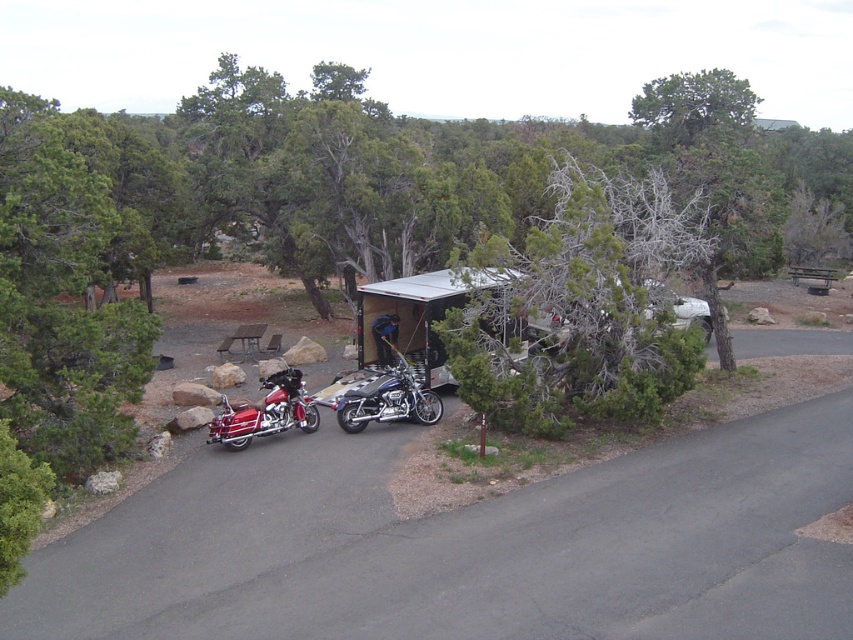
You are planning to set up a picnic table between the shiny blue chrome motorcycle at center and the brown wooden picnic table at center. Which side of the picnic table should you place the motorcycle on?

The shiny blue chrome motorcycle at center is already to the right of the brown wooden picnic table at center, so you should place the motorcycle on the right side of the picnic table.

You are planning to transport both the shiny blue chrome motorcycle at center and the brown wooden picnic table at center in a truck. Given that the truck bed is 2 meters wide, can both items fit side by side without overlapping?

The shiny blue chrome motorcycle at center is wider than the brown wooden picnic table at center. Since the truck bed is only 2 meters wide, and the motorcycle alone is already wider than the picnic table, it is likely that both items together would exceed the truck bed width and cannot fit side by side without overlapping.